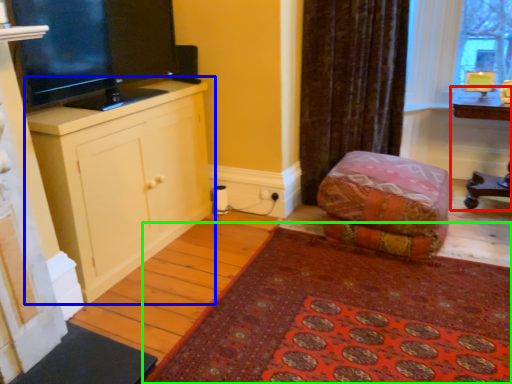
Question: Which object is positioned farthest from table (highlighted by a red box)? Select from cabinetry (highlighted by a blue box) and mat (highlighted by a green box).

Choices:
 (A) cabinetry
 (B) mat

Answer: (A)